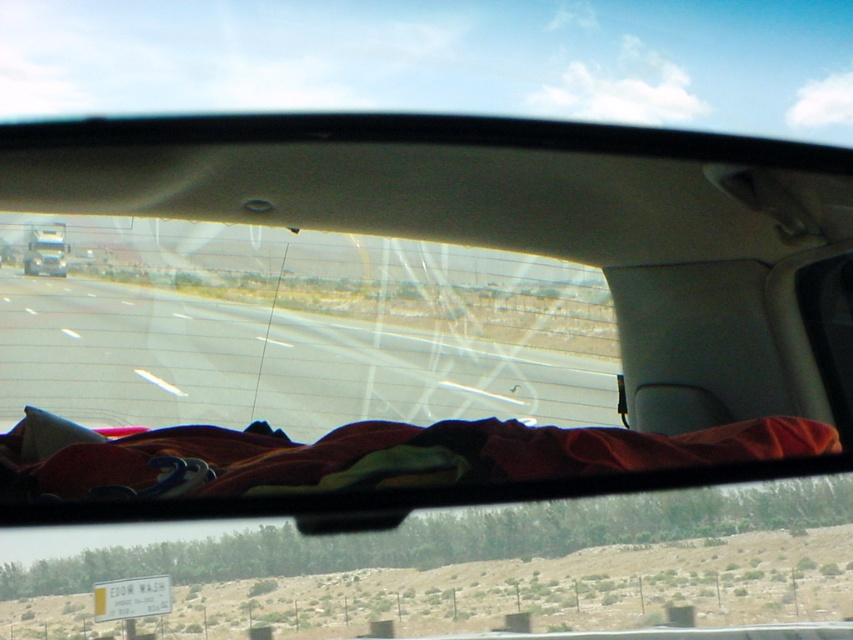
Who is lower down, velvet-like red blanket at lower center or metallic silver truck at left?

velvet-like red blanket at lower center is below.

Which is behind, point (22, 500) or point (62, 272)?

The point (62, 272) is behind.

Is point (36, 435) more distant than point (54, 243)?

No, (36, 435) is closer to viewer.

I want to click on velvet-like red blanket at lower center, so click(364, 456).

Is transparent glass car window at center smaller than velvet-like red blanket at lower center?

No.

Is point (59, 403) positioned after point (175, 472)?

Yes, it is.

At what (x,y) coordinates should I click in order to perform the action: click on transparent glass car window at center. Please return your answer as a coordinate pair (x, y). Looking at the image, I should click on (296, 330).

In the scene shown: Measure the distance from transparent glass car window at center to metallic silver truck at left.

transparent glass car window at center and metallic silver truck at left are 7.12 meters apart from each other.

Can you confirm if transparent glass car window at center is thinner than metallic silver truck at left?

No, transparent glass car window at center is not thinner than metallic silver truck at left.

Between point (107, 240) and point (51, 259), which one is positioned behind?

Point (51, 259)

This screenshot has height=640, width=853. I want to click on transparent glass car window at center, so click(296, 330).